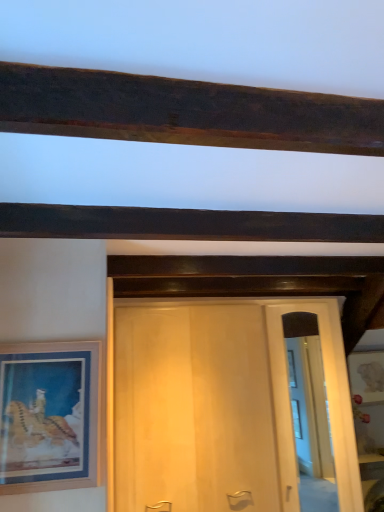
Question: Would you say clear glass door at center is to the left or to the right of wooden picture frame at left in the picture?

Choices:
 (A) left
 (B) right

Answer: (B)

Question: In terms of width, does clear glass door at center look wider or thinner when compared to wooden picture frame at left?

Choices:
 (A) thin
 (B) wide

Answer: (A)

Question: Which object is positioned farthest from the clear glass door at center?

Choices:
 (A) dark wood beam at upper center
 (B) wooden picture frame at left

Answer: (B)

Question: Which of these objects is positioned closest to the clear glass door at center?

Choices:
 (A) dark wood beam at upper center
 (B) wooden picture frame at left

Answer: (A)